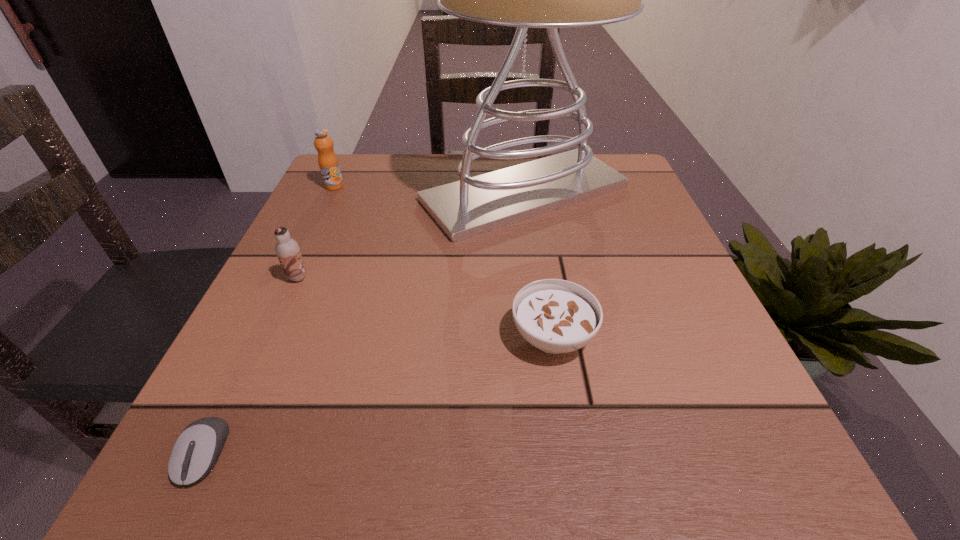
Where is `vacant area that lies between the soup bowl and the nearest object`? The height and width of the screenshot is (540, 960). vacant area that lies between the soup bowl and the nearest object is located at coordinates (378, 395).

This screenshot has height=540, width=960. In order to click on vacant space that is in between the shortest object and the fourth farthest object in this screenshot , I will do `click(378, 395)`.

Image resolution: width=960 pixels, height=540 pixels. Find the location of `free point between the second tallest object and the fourth tallest object`. free point between the second tallest object and the fourth tallest object is located at coordinates (444, 261).

Where is `vacant point located between the fourth farthest object and the fourth shortest object`? vacant point located between the fourth farthest object and the fourth shortest object is located at coordinates (444, 261).

You are a GUI agent. You are given a task and a screenshot of the screen. Output one action in this format:
    pyautogui.click(x=<x>, y=<y>)
    Task: Click on the vacant area between the chocolate milk and the computer equipment
    The height and width of the screenshot is (540, 960).
    Given the screenshot: What is the action you would take?
    pyautogui.click(x=251, y=366)

Identify the location of blank region between the third farthest object and the table lamp. (411, 235).

Where is `free spot between the orange juice and the fourth farthest object`? free spot between the orange juice and the fourth farthest object is located at coordinates (444, 261).

Locate which object ranks third in proximity to the shortest object. Please provide its 2D coordinates. Your answer should be formatted as a tuple, i.e. [(x, y)], where the tuple contains the x and y coordinates of a point satisfying the conditions above.

[(474, 205)]

Where is `object that stands as the third closest to the computer equipment`? object that stands as the third closest to the computer equipment is located at coordinates (474, 205).

At what (x,y) coordinates should I click in order to perform the action: click on free space that satisfies the following two spatial constraints: 1. on the front label of the fourth tallest object; 2. on the left side of the fourth shortest object. Please return your answer as a coordinate pair (x, y). The height and width of the screenshot is (540, 960). Looking at the image, I should click on (263, 336).